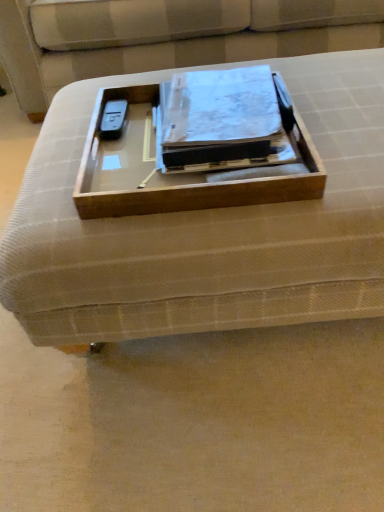
The height and width of the screenshot is (512, 384). Identify the location of vacant space to the right of wooden tray at center. (339, 114).